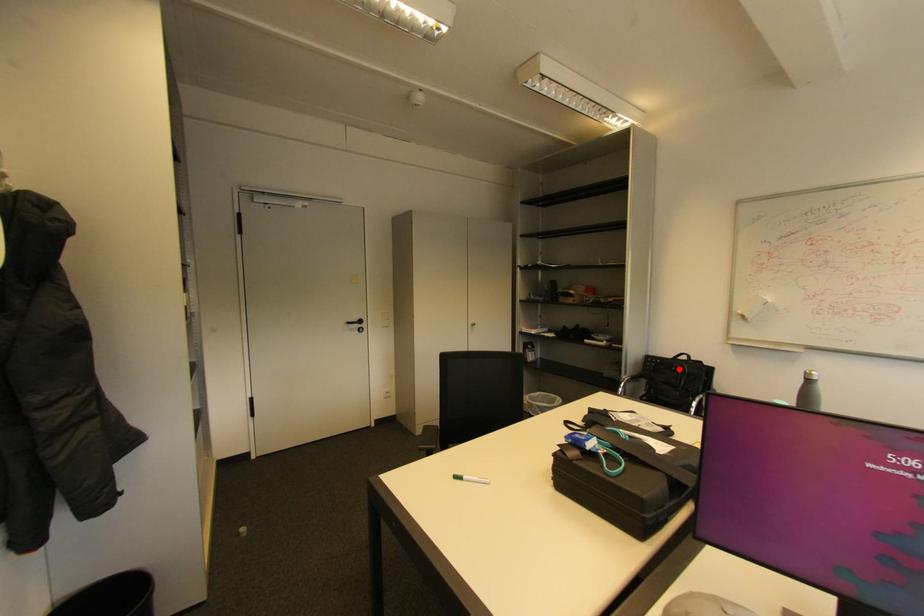
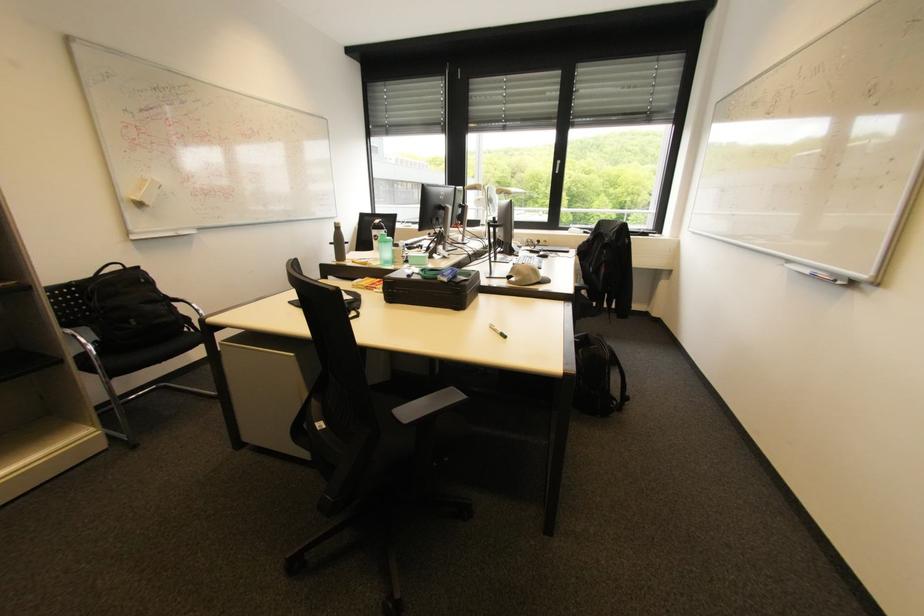
Locate, in the second image, the point that corresponds to the highlighted location in the first image.

(148, 281)